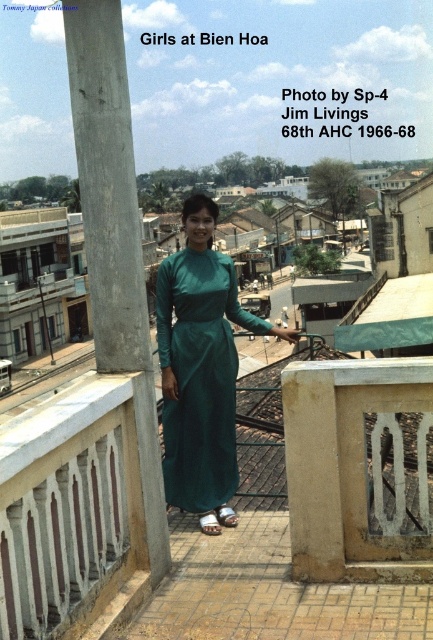
Question: From the image, what is the correct spatial relationship of concrete at center in relation to emerald green silk dress at center?

Choices:
 (A) right
 (B) left

Answer: (B)

Question: Which object is the farthest from the white concrete porch at center?

Choices:
 (A) concrete at center
 (B) emerald green silk dress at center

Answer: (B)

Question: Can you confirm if white concrete porch at center is smaller than concrete at center?

Choices:
 (A) no
 (B) yes

Answer: (B)

Question: Which point is farther to the camera?

Choices:
 (A) white concrete porch at center
 (B) emerald green silk dress at center
 (C) concrete at center

Answer: (B)

Question: Which object is closer to the camera taking this photo?

Choices:
 (A) emerald green silk dress at center
 (B) white concrete porch at center
 (C) concrete at center

Answer: (B)

Question: Does white concrete porch at center appear over concrete at center?

Choices:
 (A) no
 (B) yes

Answer: (A)